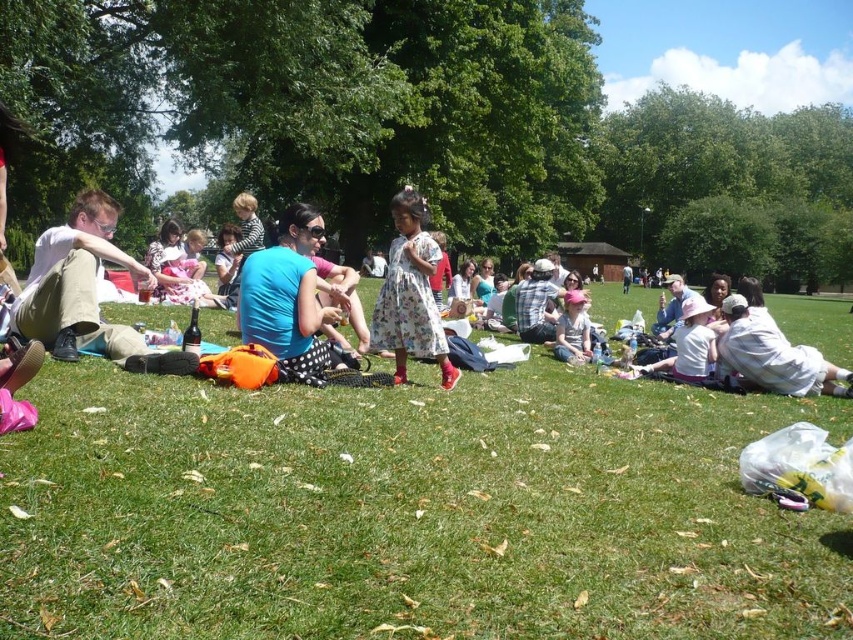
Based on the coordinates provided, what is the color of the area at point (408, 509) in the scene?

The area at point (408, 509) is green grass at center.

You are a photographer trying to capture a group photo of the matte khaki pants at left and the floral dress at center. If you want to ensure both subjects are in focus, which one should you focus on first considering their size in the frame?

The matte khaki pants at left might be wider than the floral dress at center, so focusing on the larger subject first would help ensure both are in focus.